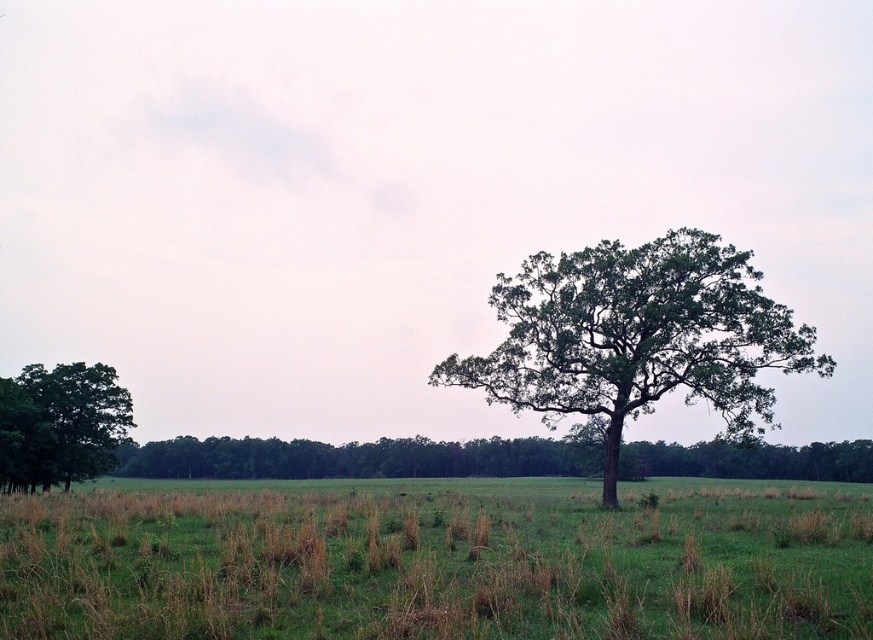
In the scene shown: You are standing in the middle of the field and want to walk towards the horizon where the tree line is. Which direction should you walk relative to the green grass at center?

Since the green grass at center is located at point (437, 560), which is slightly to the right and middle of the image, you should walk towards the horizon line where the tree line is located, which is at the top edge of the image. Therefore, you should walk forward and slightly to the left relative to the green grass at center to face the horizon.

You are a landscape photographer planning to capture the entire scene in one shot. The green leafy oak tree at center and the green leafy tree at left are both in your frame. Which tree will appear wider in the photo?

The green leafy oak tree at center will appear wider in the photo because its width is larger than the green leafy tree at left.

You are standing in the middle of the field and see the point marked at coordinates [356,458]. Based on the scene description, can you determine which object this point is located on?

The point at coordinates [356,458] is located on the green leafy tree at center.